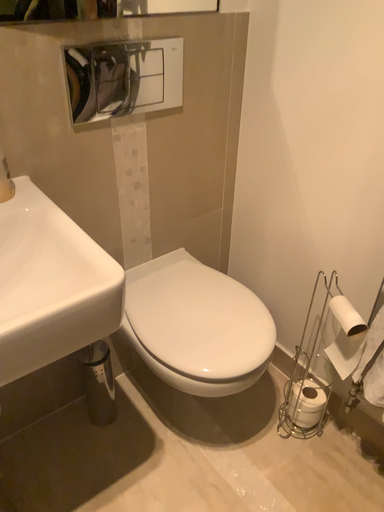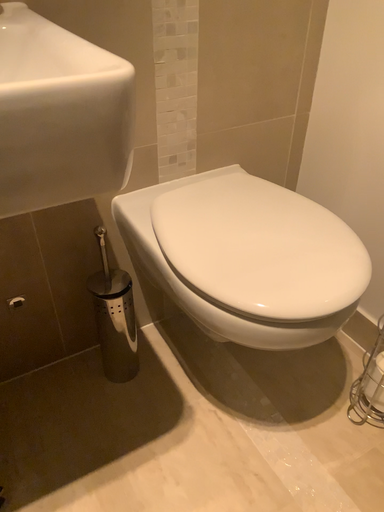
Question: How did the camera likely rotate when shooting the video?

Choices:
 (A) rotated left
 (B) rotated right

Answer: (A)